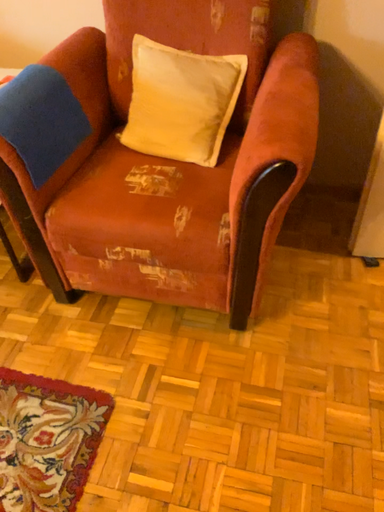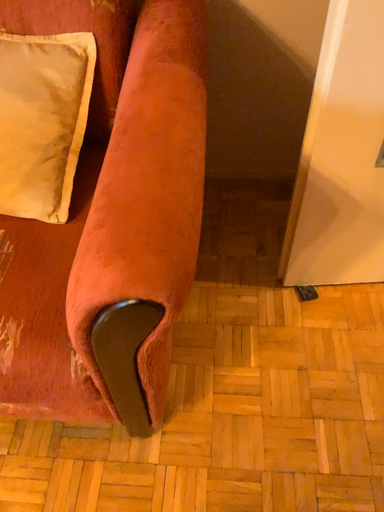
Question: How did the camera likely rotate when shooting the video?

Choices:
 (A) rotated left
 (B) rotated right

Answer: (B)